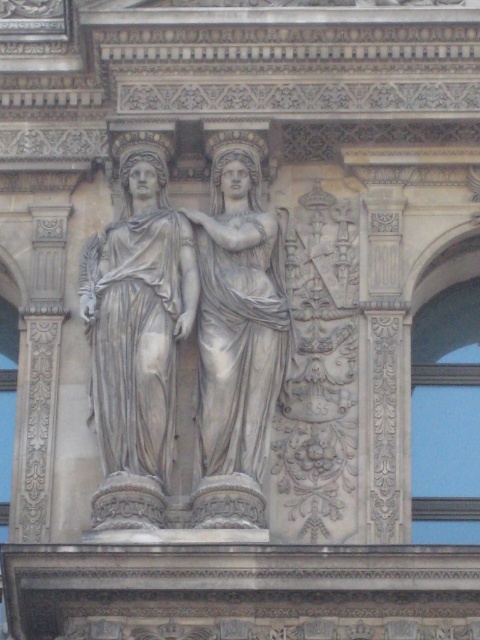
Question: Can you confirm if gray marble statue at center is positioned to the right of white marble statue at center?

Choices:
 (A) no
 (B) yes

Answer: (A)

Question: Where is gray marble statue at center located in relation to white marble statue at center in the image?

Choices:
 (A) above
 (B) below

Answer: (B)

Question: Among these objects, which one is farthest from the camera?

Choices:
 (A) white marble statue at center
 (B) gray marble statue at center

Answer: (A)

Question: Does gray marble statue at center appear under white marble statue at center?

Choices:
 (A) yes
 (B) no

Answer: (A)

Question: Which point is closer to the camera taking this photo?

Choices:
 (A) (129, 467)
 (B) (250, 468)

Answer: (A)